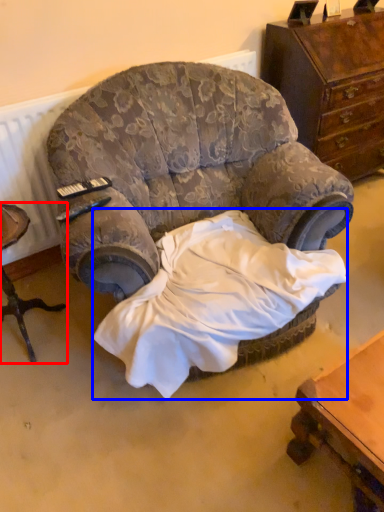
Question: Which point is further to the camera, furniture (highlighted by a red box) or sheet (highlighted by a blue box)?

Choices:
 (A) furniture
 (B) sheet

Answer: (A)